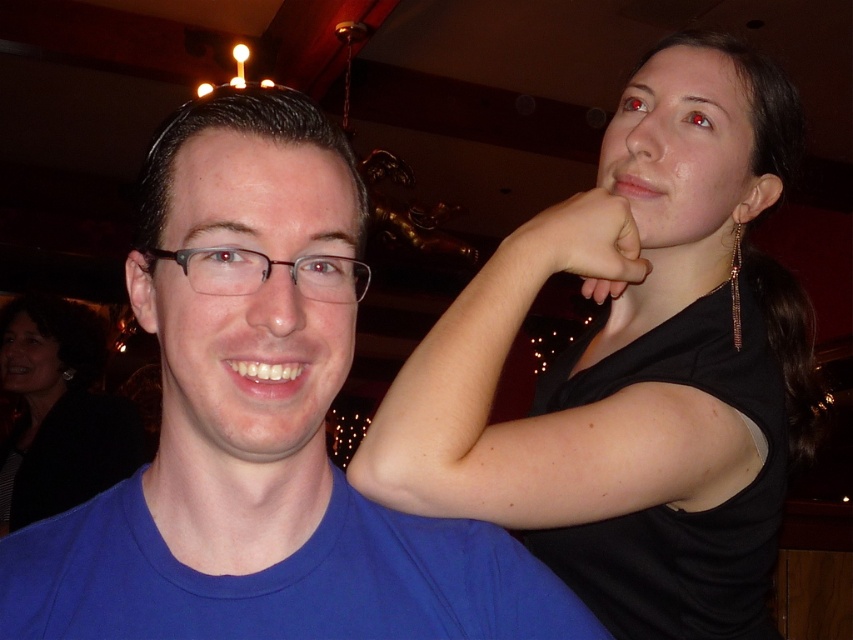
You are trying to decide which object is higher in the image. You see the black matte shirt at upper right and the brown plastic glasses at center. Based on their positions, which one is located higher?

The black matte shirt at upper right is taller than brown plastic glasses at center, so the black matte shirt at upper right is higher.

From the picture: You are a photographer trying to capture a clear shot of the black matte shirt at upper right and the matte skin hand at upper right. Which object should you focus on to ensure the other remains in the background?

You should focus on the black matte shirt at upper right because it is in front of the matte skin hand at upper right, so focusing on it will keep the hand in the background.